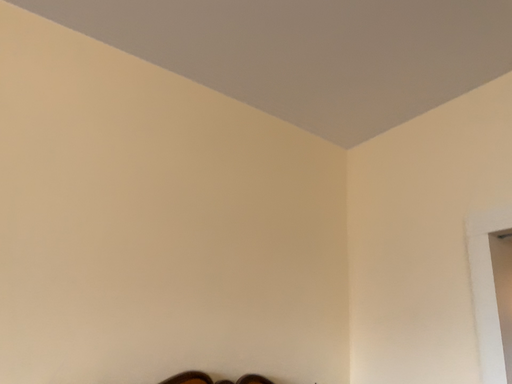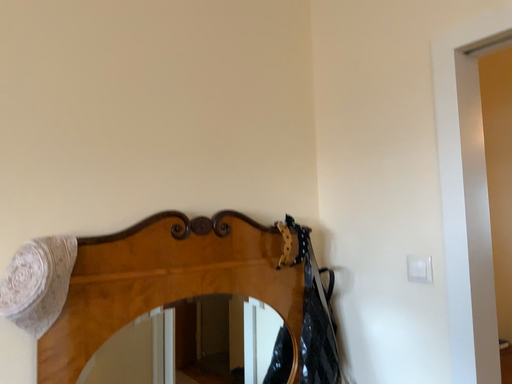
Question: Which way did the camera rotate in the video?

Choices:
 (A) rotated downward
 (B) rotated upward

Answer: (A)